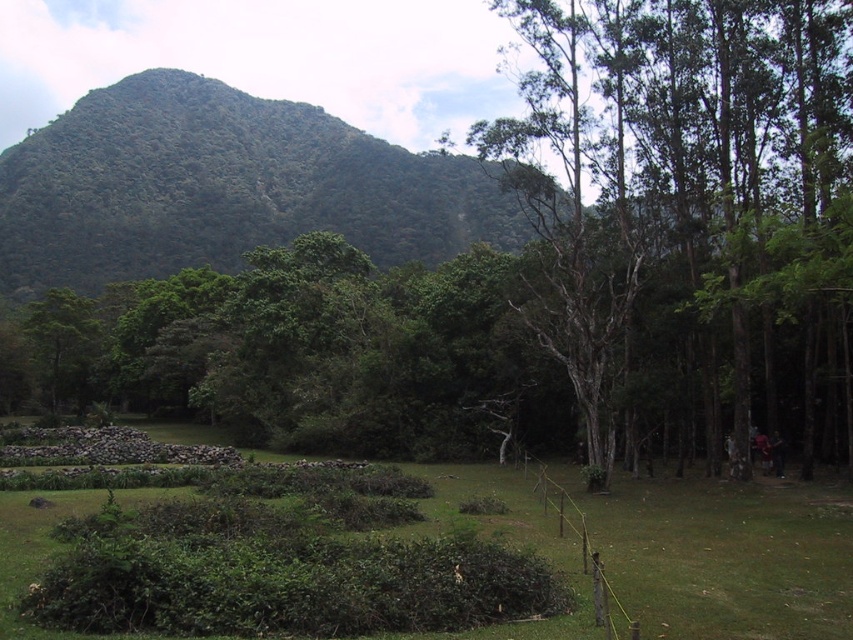
You are standing at the center of the image and want to walk towards the green leafy tree at right. Which direction should you move?

To reach the green leafy tree at right, you should move towards the right side of the image since its coordinates are at point [686,193], which places it on the right side.